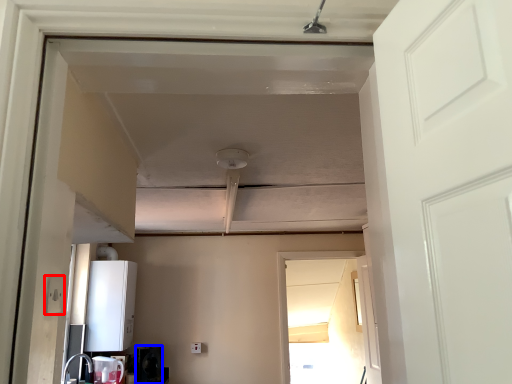
Question: Which object appears farthest to the camera in this image, electric outlet (highlighted by a red box) or appliance (highlighted by a blue box)?

Choices:
 (A) electric outlet
 (B) appliance

Answer: (B)